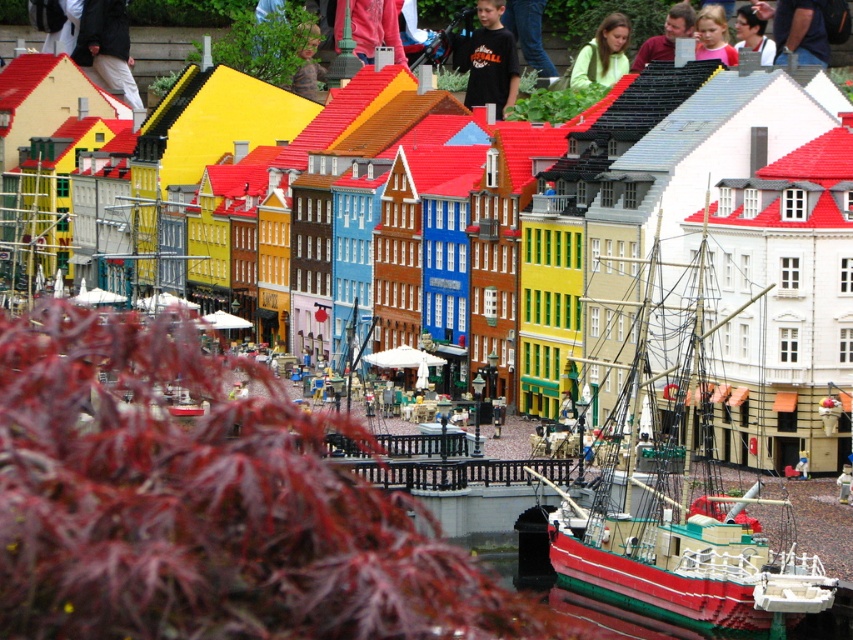
Image resolution: width=853 pixels, height=640 pixels. What do you see at coordinates (106, 48) in the screenshot?
I see `matte black pants at upper left` at bounding box center [106, 48].

Is matte black pants at upper left to the right of dark blue shirt at upper right from the viewer's perspective?

In fact, matte black pants at upper left is to the left of dark blue shirt at upper right.

In order to click on matte black pants at upper left in this screenshot , I will do `click(106, 48)`.

Identify the location of matte black pants at upper left. click(106, 48).

Looking at this image, between matte black pants at upper left and black cotton shirt at center, which one appears on the right side from the viewer's perspective?

black cotton shirt at center is more to the right.

What do you see at coordinates (106, 48) in the screenshot? I see `matte black pants at upper left` at bounding box center [106, 48].

What do you see at coordinates (106, 48) in the screenshot? This screenshot has height=640, width=853. I see `matte black pants at upper left` at bounding box center [106, 48].

This screenshot has width=853, height=640. In order to click on matte black pants at upper left in this screenshot , I will do `click(106, 48)`.

Can you confirm if matte black pants at upper left is positioned to the right of smooth skin face at center?

Incorrect, matte black pants at upper left is not on the right side of smooth skin face at center.

Find the location of a particular element. The width and height of the screenshot is (853, 640). matte black pants at upper left is located at coordinates coord(106,48).